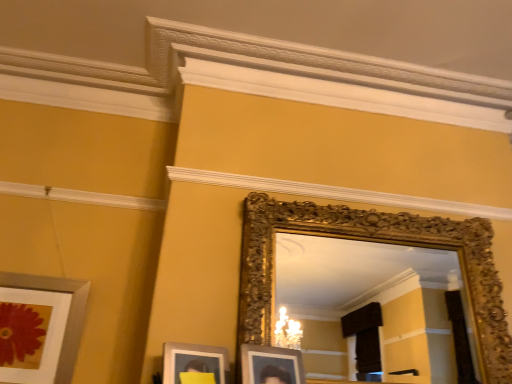
Question: Considering the positions of point (380, 292) and point (79, 326), is point (380, 292) closer or farther from the camera than point (79, 326)?

Choices:
 (A) farther
 (B) closer

Answer: (A)

Question: From a real-world perspective, is gold ornate mirror at upper center physically located above or below silver metallic picture frame at lower left?

Choices:
 (A) below
 (B) above

Answer: (B)

Question: Is gold ornate mirror at upper center wider or thinner than silver metallic picture frame at lower left?

Choices:
 (A) thin
 (B) wide

Answer: (B)

Question: From a real-world perspective, is silver metallic picture frame at lower left physically located above or below gold ornate mirror at upper center?

Choices:
 (A) above
 (B) below

Answer: (B)

Question: Is silver metallic picture frame at lower left inside or outside of gold ornate mirror at upper center?

Choices:
 (A) outside
 (B) inside

Answer: (A)

Question: Considering the positions of silver metallic picture frame at lower left and gold ornate mirror at upper center in the image, is silver metallic picture frame at lower left wider or thinner than gold ornate mirror at upper center?

Choices:
 (A) thin
 (B) wide

Answer: (A)

Question: In the image, is silver metallic picture frame at lower left on the left side or the right side of gold ornate mirror at upper center?

Choices:
 (A) left
 (B) right

Answer: (A)